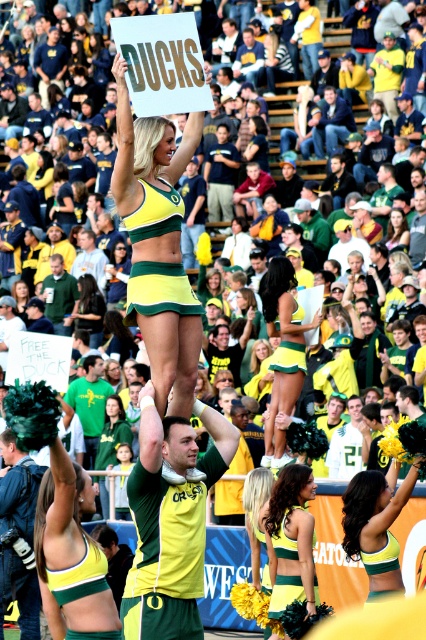
Which is more to the left, matte green pom-pom at center or matte green and yellow cheerleader at center?

From the viewer's perspective, matte green pom-pom at center appears more on the left side.

Can you confirm if matte green pom-pom at center is taller than matte green and yellow cheerleader at center?

Indeed, matte green pom-pom at center has a greater height compared to matte green and yellow cheerleader at center.

Does point (40, 417) lie behind point (271, 515)?

No, it is not.

Locate an element on the screen. matte green pom-pom at center is located at coordinates (63, 525).

Is matte green pom-pom at center to the left of matte yellow-green cheerleader at center from the viewer's perspective?

Correct, you'll find matte green pom-pom at center to the left of matte yellow-green cheerleader at center.

Who is higher up, matte green pom-pom at center or matte yellow-green cheerleader at center?

matte yellow-green cheerleader at center

In order to click on matte green pom-pom at center in this screenshot , I will do `click(63, 525)`.

Looking at this image, can you confirm if yellow-green fabric cheerleader at center is smaller than matte green and yellow cheerleader at center?

Incorrect, yellow-green fabric cheerleader at center is not smaller in size than matte green and yellow cheerleader at center.

Can you confirm if yellow-green fabric cheerleader at center is thinner than matte green and yellow cheerleader at center?

In fact, yellow-green fabric cheerleader at center might be wider than matte green and yellow cheerleader at center.

Locate an element on the screen. yellow-green fabric cheerleader at center is located at coordinates (152, 150).